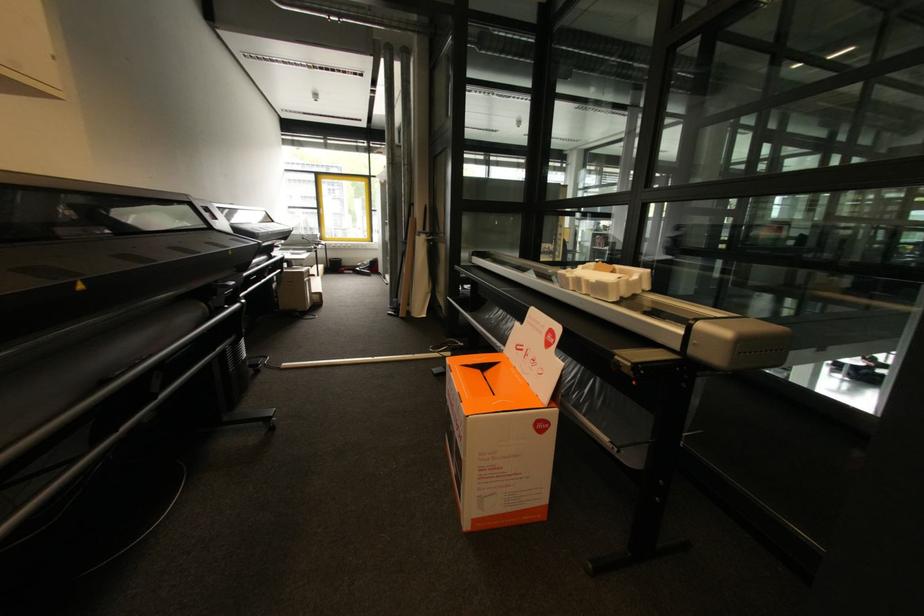
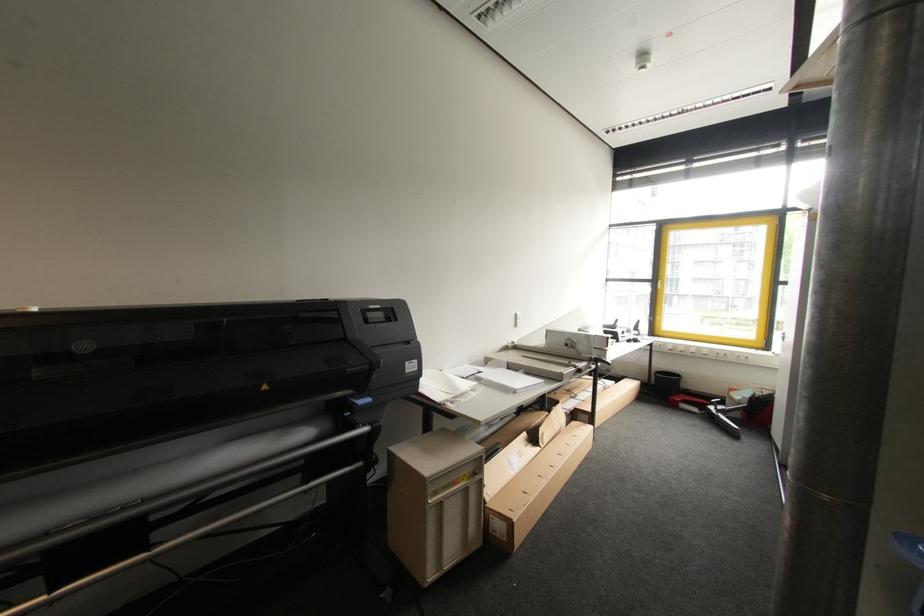
Find the pixel in the second image that matches pixel 322 209 in the first image.

(660, 281)